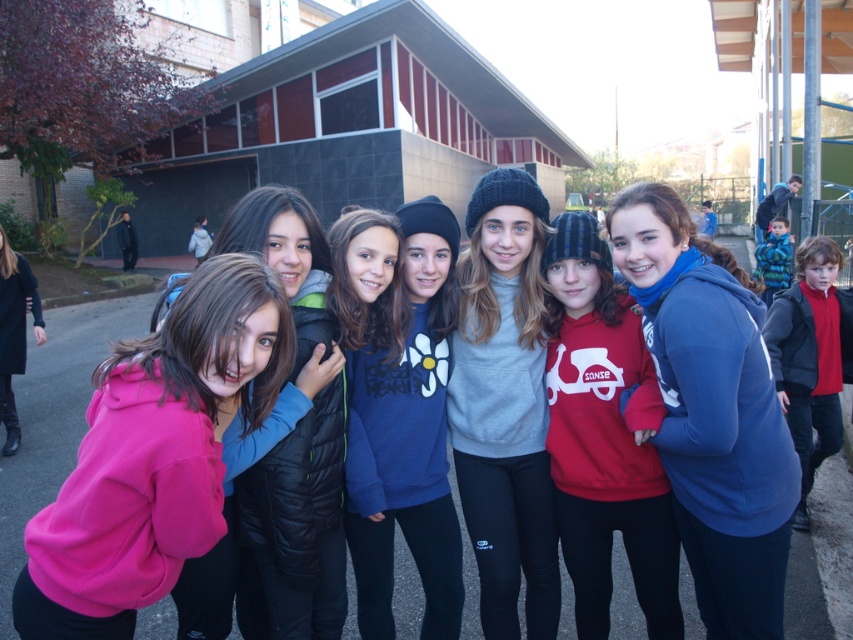
Question: Which object is the farthest from the red fleece jacket at right?

Choices:
 (A) red fleece hoodie at center
 (B) pink fleece jacket at lower left
 (C) pink fleece jacket at left

Answer: (B)

Question: Can you confirm if blue fleece sweatshirt at center is wider than red fleece jacket at right?

Choices:
 (A) no
 (B) yes

Answer: (A)

Question: Which point is closer to the camera?

Choices:
 (A) (625, 512)
 (B) (646, 250)
 (C) (3, 451)
 (D) (814, 358)

Answer: (B)

Question: Is pink fleece sweatshirt at center above blue fleece jacket at center?

Choices:
 (A) no
 (B) yes

Answer: (A)

Question: Considering the real-world distances, which object is farthest from the pink fleece jacket at lower left?

Choices:
 (A) red fleece hoodie at center
 (B) pink fleece sweatshirt at center
 (C) gray knit beanie at center
 (D) blue fleece sweatshirt at center

Answer: (A)

Question: Does gray knit beanie at center have a lesser width compared to blue fleece sweatshirt at center?

Choices:
 (A) yes
 (B) no

Answer: (B)